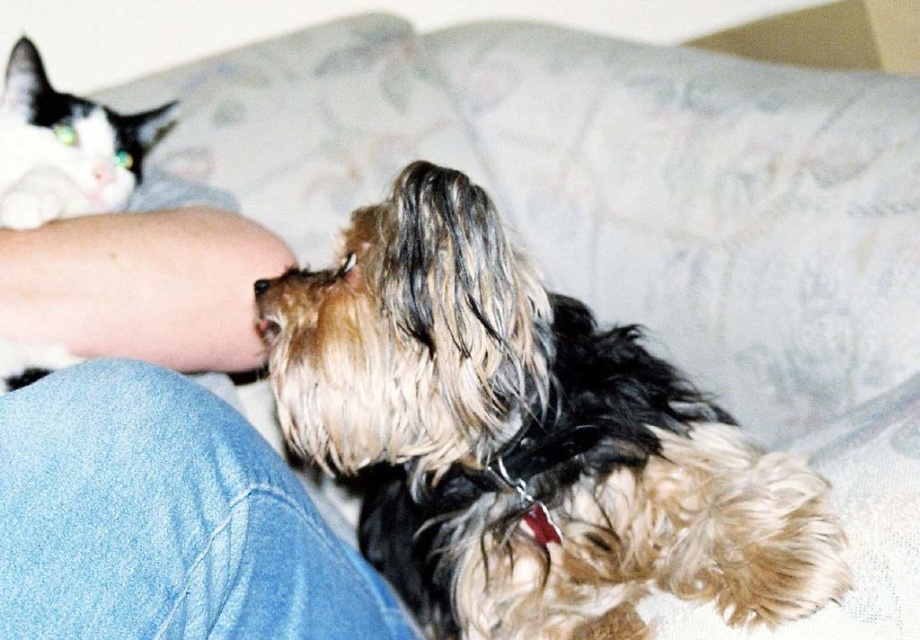
Is point (370, 637) positioned after point (46, 97)?

No, (370, 637) is in front of (46, 97).

Which is in front, point (81, 460) or point (10, 212)?

Point (81, 460) is more forward.

What do you see at coordinates (164, 522) in the screenshot?
I see `blue denim jeans at lower left` at bounding box center [164, 522].

Find the location of a particular element. This screenshot has height=640, width=920. blue denim jeans at lower left is located at coordinates (164, 522).

Is point (211, 628) positioned after point (92, 168)?

That is False.

Is blue denim jeans at lower left smaller than white glossy cat nose at upper left?

No, blue denim jeans at lower left is not smaller than white glossy cat nose at upper left.

The height and width of the screenshot is (640, 920). In order to click on blue denim jeans at lower left in this screenshot , I will do `click(164, 522)`.

Between fuzzy fur dog at center and white glossy cat nose at upper left, which one is positioned higher?

white glossy cat nose at upper left

What do you see at coordinates (525, 438) in the screenshot?
I see `fuzzy fur dog at center` at bounding box center [525, 438].

What are the coordinates of `fuzzy fur dog at center` in the screenshot? It's located at (525, 438).